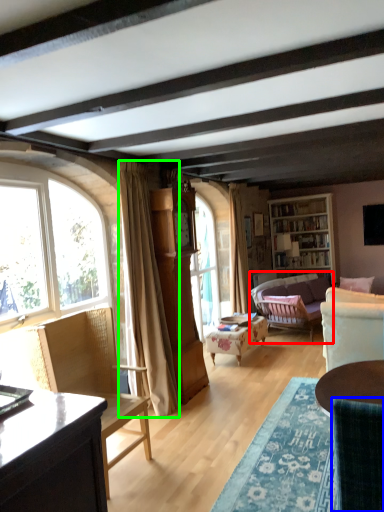
Question: Which object is the farthest from studio couch (highlighted by a red box)? Choose among these: chair (highlighted by a blue box) or curtain (highlighted by a green box).

Choices:
 (A) chair
 (B) curtain

Answer: (A)